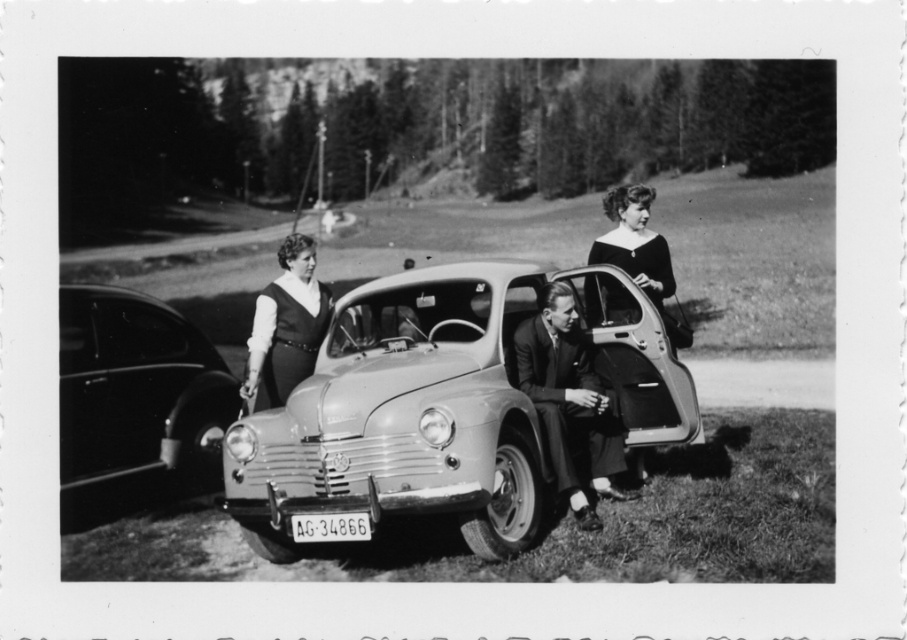
Question: Considering the real-world distances, which object is farthest from the metallic gray car at center?

Choices:
 (A) shiny black car at left
 (B) smooth black dress at center
 (C) matte black dress at center

Answer: (A)

Question: Which point appears farthest from the camera in this image?

Choices:
 (A) (268, 436)
 (B) (363, 515)

Answer: (A)

Question: Is smooth suit jacket at center bigger than matte black dress at center?

Choices:
 (A) yes
 (B) no

Answer: (A)

Question: Is shiny black car at left closer to camera compared to smooth black dress at center?

Choices:
 (A) yes
 (B) no

Answer: (A)

Question: Which point appears closest to the camera in this image?

Choices:
 (A) click(x=662, y=304)
 (B) click(x=593, y=524)

Answer: (B)

Question: Is metallic gray car at center below metallic gray license plate at center?

Choices:
 (A) no
 (B) yes

Answer: (A)